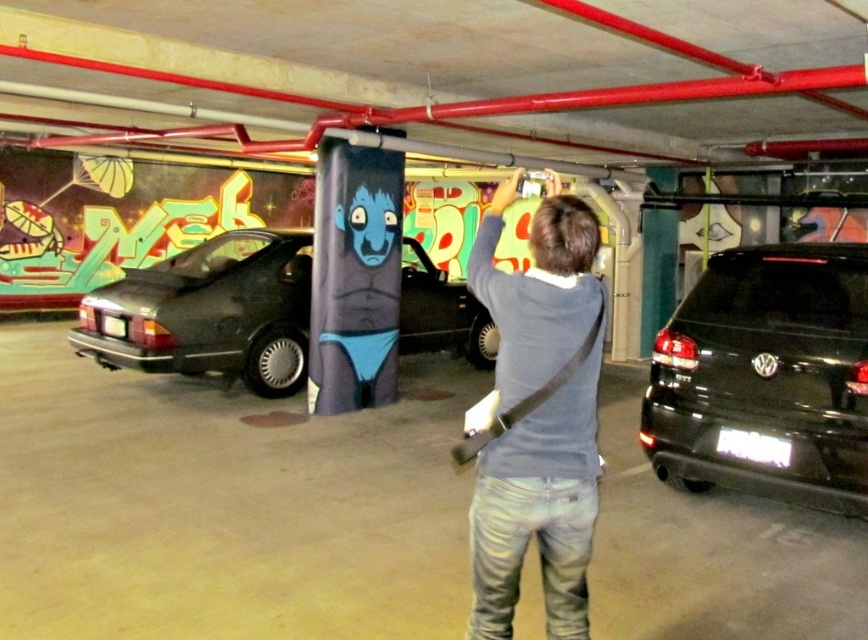
Does black matte suv at right appear on the left side of black matte car at left?

No, black matte suv at right is not to the left of black matte car at left.

The width and height of the screenshot is (868, 640). What are the coordinates of `black matte suv at right` in the screenshot? It's located at (766, 378).

Where is `black matte suv at right`? This screenshot has width=868, height=640. black matte suv at right is located at coordinates (766, 378).

Is point (560, 227) positioned after point (225, 346)?

No, (560, 227) is in front of (225, 346).

Measure the distance from dark blue sweater at center to black matte car at left.

dark blue sweater at center and black matte car at left are 5.04 meters apart from each other.

You are a GUI agent. You are given a task and a screenshot of the screen. Output one action in this format:
    pyautogui.click(x=<x>, y=<y>)
    Task: Click on the dark blue sweater at center
    
    Given the screenshot: What is the action you would take?
    pyautogui.click(x=538, y=509)

What do you see at coordinates (766, 378) in the screenshot? I see `black matte suv at right` at bounding box center [766, 378].

Is black matte suv at right positioned behind dark blue sweater at center?

Yes.

Is point (811, 342) positioned before point (582, 392)?

No, it is not.

Locate an element on the screen. black matte suv at right is located at coordinates (766, 378).